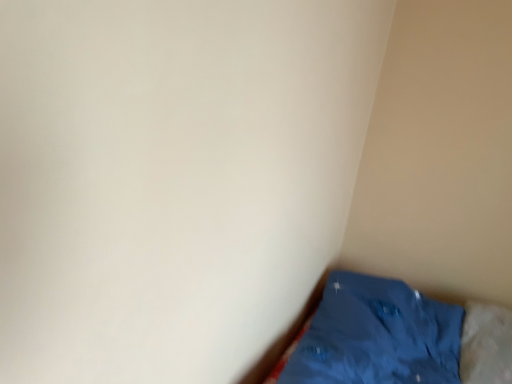
Locate an element on the screen. blue fabric at lower right is located at coordinates (397, 338).

Describe the element at coordinates (397, 338) in the screenshot. I see `blue fabric at lower right` at that location.

In order to click on blue fabric at lower right in this screenshot , I will do `click(397, 338)`.